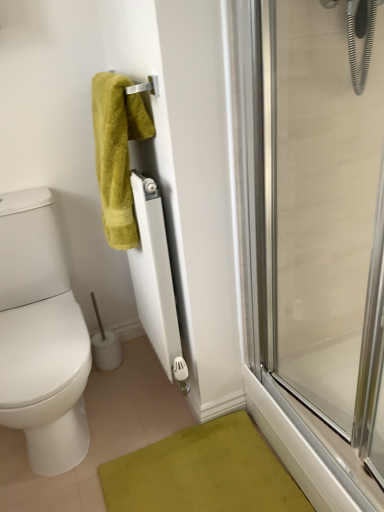
Question: From a real-world perspective, relative to green fuzzy towel at upper left, is white matte radiator at center vertically above or below?

Choices:
 (A) above
 (B) below

Answer: (B)

Question: In the image, is white matte radiator at center positioned in front of or behind green fuzzy towel at upper left?

Choices:
 (A) behind
 (B) front

Answer: (A)

Question: Which object is the closest to the green fuzzy towel at upper left?

Choices:
 (A) white matte radiator at center
 (B) transparent glass shower door at right

Answer: (A)

Question: Estimate the real-world distances between objects in this image. Which object is closer to the white matte radiator at center?

Choices:
 (A) transparent glass shower door at right
 (B) green fuzzy towel at upper left

Answer: (B)